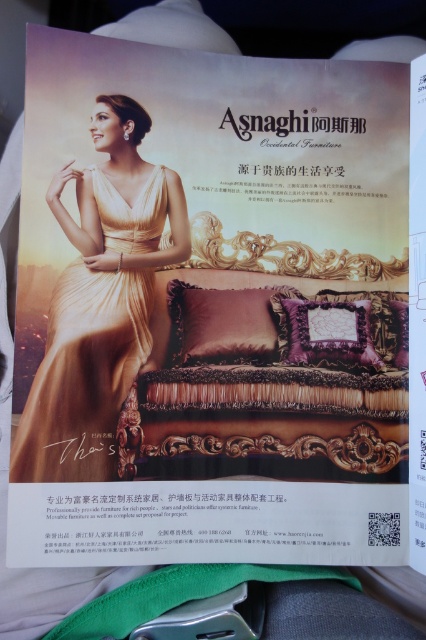
Question: Which point is farther to the camera?

Choices:
 (A) gold satin dress at left
 (B) satin purple pillow at center
 (C) velvet purple pillow at center

Answer: (C)

Question: Does gold satin dress at left have a lesser width compared to velvet purple pillow at center?

Choices:
 (A) yes
 (B) no

Answer: (B)

Question: Which point appears farthest from the camera in this image?

Choices:
 (A) (152, 221)
 (B) (238, 328)

Answer: (B)

Question: Which object is closer to the camera taking this photo?

Choices:
 (A) gold satin dress at left
 (B) satin purple pillow at center
 (C) velvet purple pillow at center

Answer: (A)

Question: Does gold satin dress at left appear on the left side of satin purple pillow at center?

Choices:
 (A) no
 (B) yes

Answer: (B)

Question: Can you confirm if gold satin dress at left is thinner than satin purple pillow at center?

Choices:
 (A) yes
 (B) no

Answer: (B)